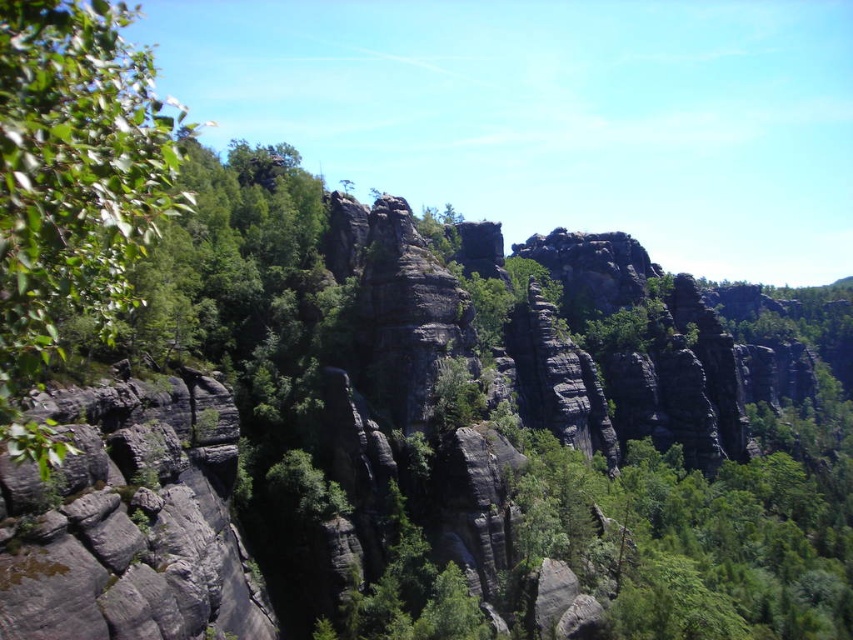
Looking at this image, you are standing at the center of the image and want to walk towards the green leafy tree at left. In which direction should you head?

The green leafy tree at left is located at point coordinates indicating it is to the left side of the image. Since you are at the center, you should head towards the left direction to reach it.

You are standing at the point marked by the coordinates point [73,188] in the image. Looking around, you see the green leafy tree at left. Which direction should you face to see the green leafy tree at left?

Since you are standing at point [73,188], which represents the green leafy tree at left, you are already at the location of the green leafy tree at left. Therefore, you cannot see it from your current position.